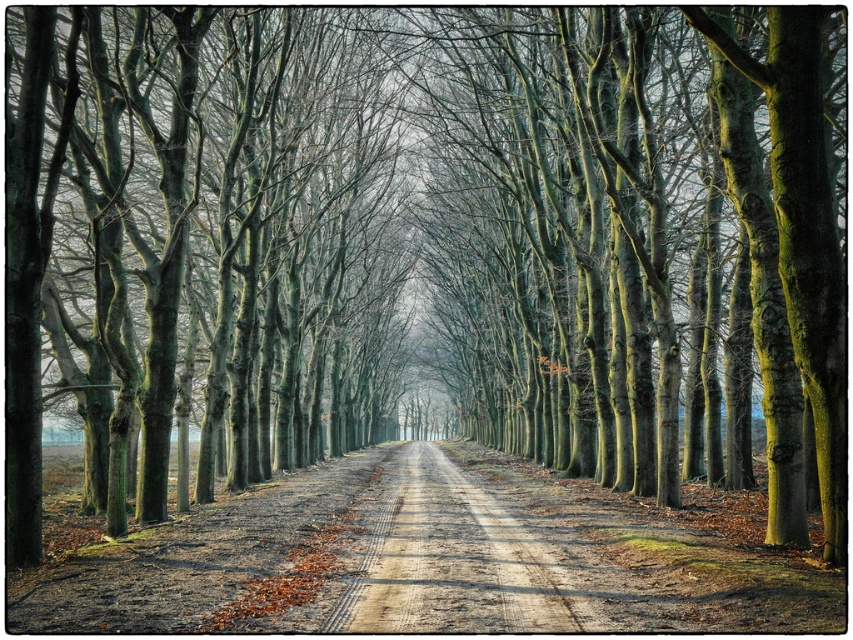
Which is in front, point (347, 157) or point (354, 616)?

Point (354, 616) is in front.

Locate an element on the screen. This screenshot has width=853, height=640. smooth bark trees at center is located at coordinates (193, 240).

Locate an element on the screen. The height and width of the screenshot is (640, 853). smooth bark trees at center is located at coordinates (193, 240).